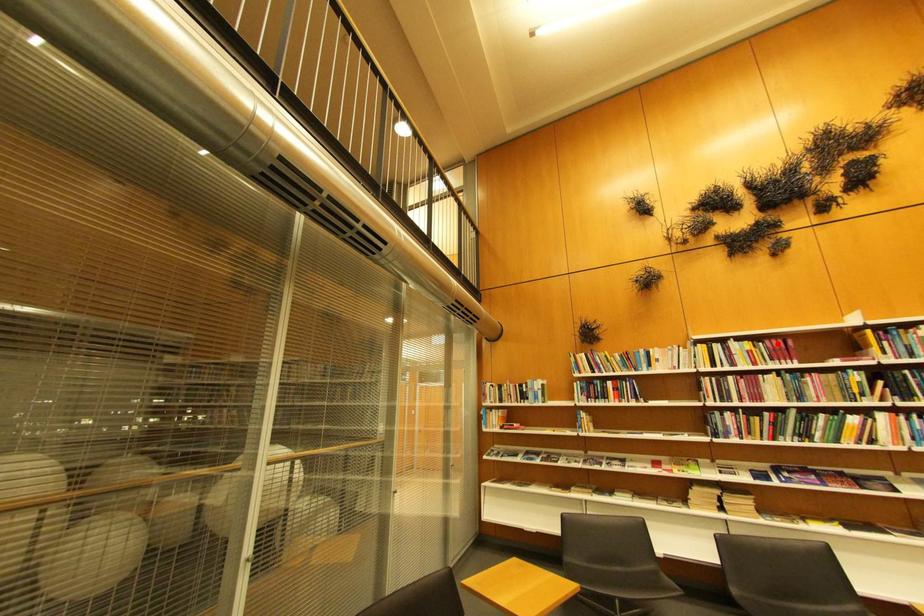
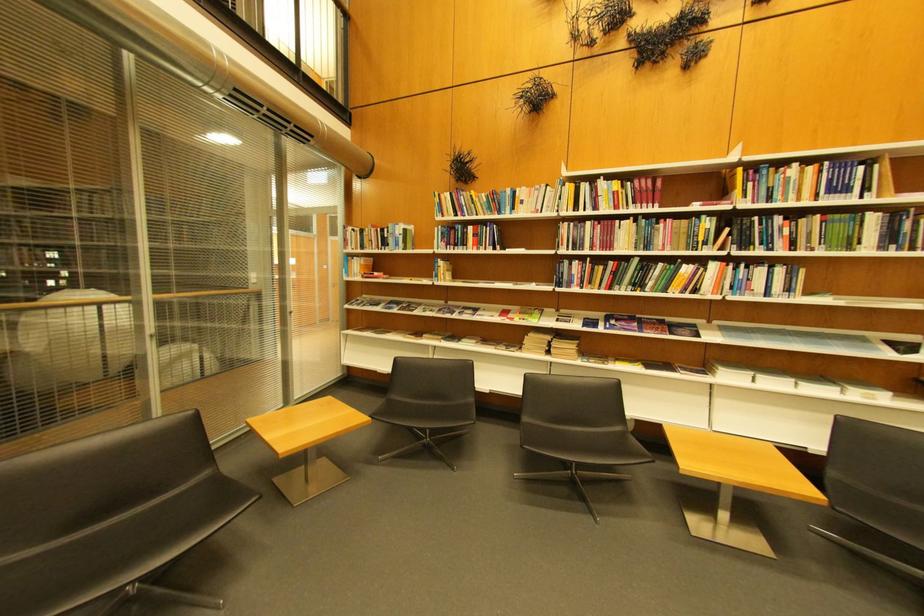
Find the pixel in the second image that matches the highlighted location in the first image.

(648, 183)